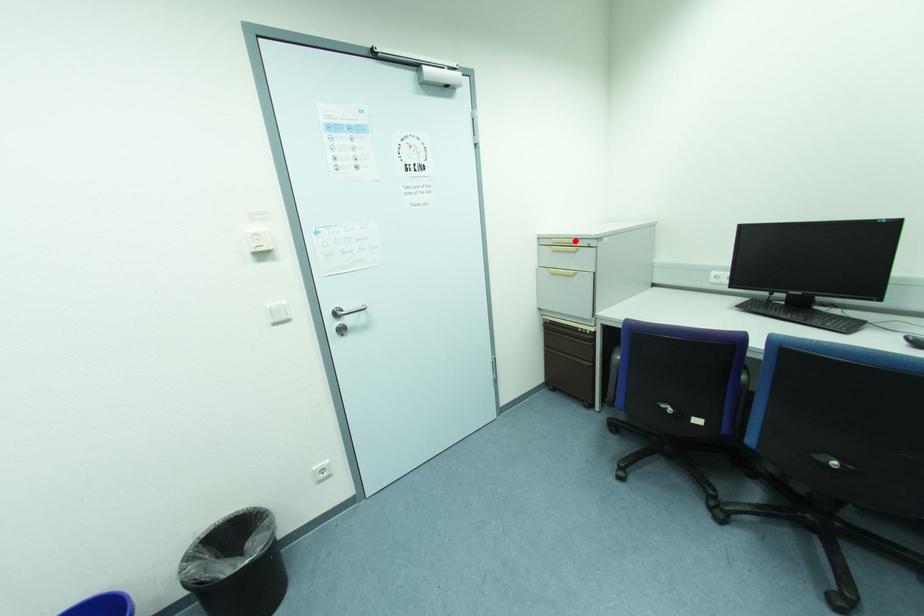
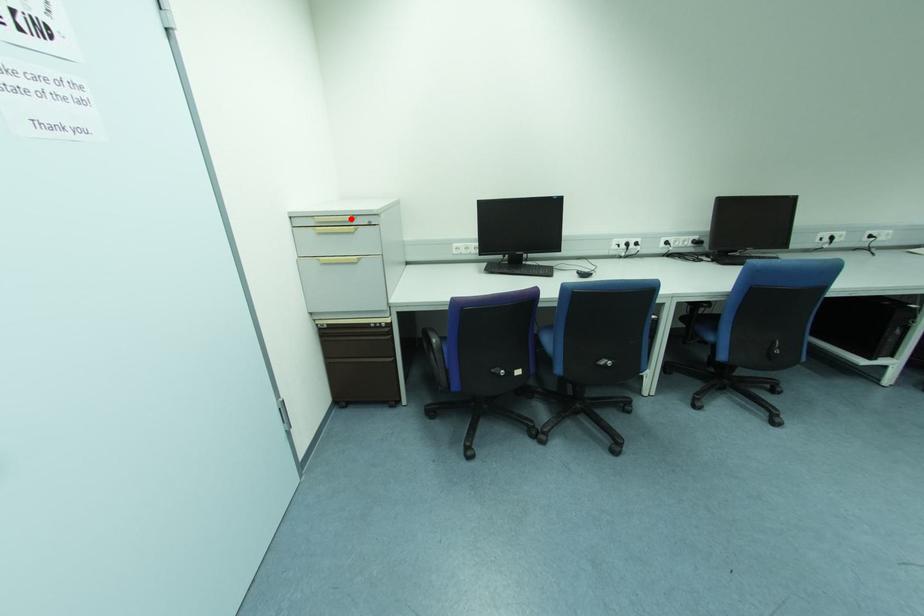
I am providing you with two images of the same scene from different viewpoints. A red point is marked on the first image and another point is marked on the second image. Is the marked point in image1 the same physical position as the marked point in image2?

Yes